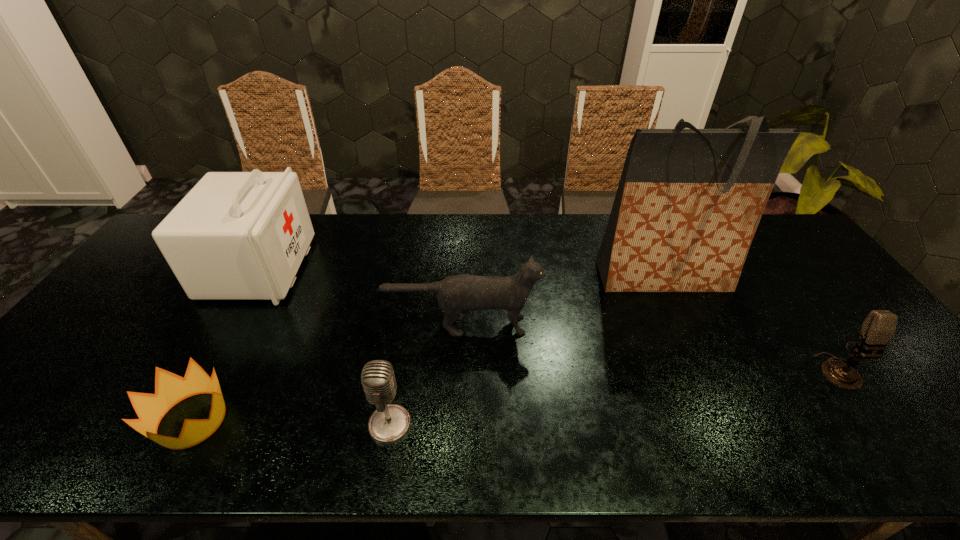
Identify the location of free region located 0.210m on the front-facing side of the cat. The height and width of the screenshot is (540, 960). (617, 325).

Find the location of a particular element. This screenshot has height=540, width=960. vacant space located on the back of the nearer microphone is located at coordinates click(404, 336).

I want to click on vacant space located on the front-facing side of the rightmost object, so click(885, 442).

Find the location of `free space located 0.280m on the right of the shortest object`. free space located 0.280m on the right of the shortest object is located at coordinates (357, 420).

Where is `shopping bag that is at the far edge`? The width and height of the screenshot is (960, 540). shopping bag that is at the far edge is located at coordinates (689, 201).

The height and width of the screenshot is (540, 960). Identify the location of the first-aid kit present at the far edge. (236, 235).

Image resolution: width=960 pixels, height=540 pixels. I want to click on microphone at the near edge, so click(389, 423).

This screenshot has height=540, width=960. What are the coordinates of `crown that is at the near edge` in the screenshot? It's located at (170, 389).

Where is `object positioned at the right edge`? Image resolution: width=960 pixels, height=540 pixels. object positioned at the right edge is located at coordinates (879, 326).

The image size is (960, 540). In the image, there is a desktop. In order to click on vacant space at the far edge in this screenshot , I will do `click(431, 240)`.